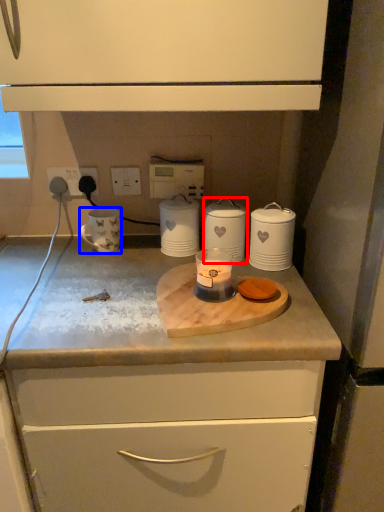
Question: Which of the following is the farthest to the observer, home appliance (highlighted by a red box) or appliance (highlighted by a blue box)?

Choices:
 (A) home appliance
 (B) appliance

Answer: (B)